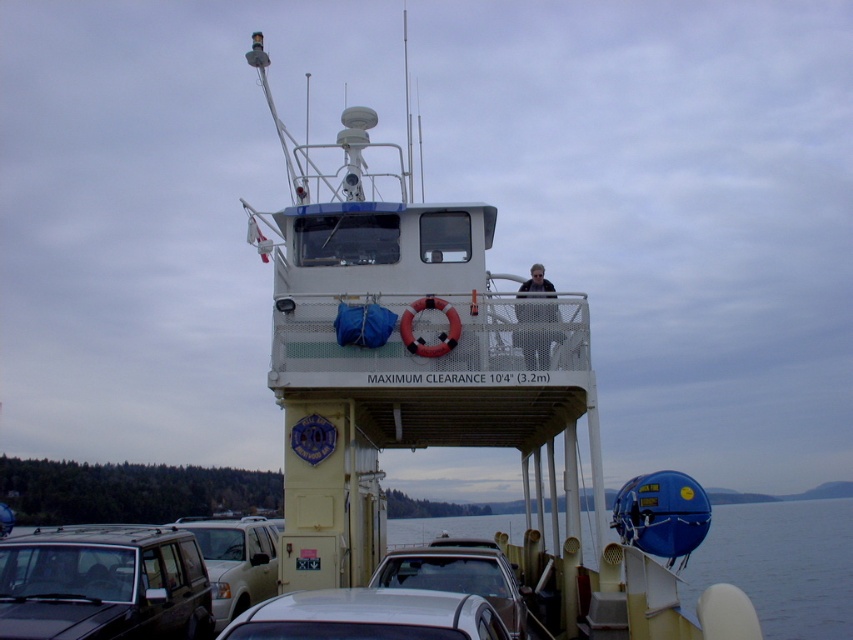
Can you confirm if silver metallic car at lower center is smaller than white glossy sedan at center?

Yes.

From the picture: Is silver metallic car at lower center further to camera compared to white glossy sedan at center?

No, it is in front of white glossy sedan at center.

Who is more forward, [456,614] or [445,564]?

Positioned in front is point [456,614].

In order to click on silver metallic car at lower center in this screenshot , I will do `click(368, 616)`.

Does matte black suv at lower left appear under metallic silver suv at lower left?

No.

Is matte black suv at lower left to the left of metallic silver suv at lower left from the viewer's perspective?

Yes, matte black suv at lower left is to the left of metallic silver suv at lower left.

Is point (137, 532) behind point (273, 561)?

No.

This screenshot has width=853, height=640. Identify the location of matte black suv at lower left. (103, 584).

Does matte black suv at lower left appear on the right side of dark gray mesh jacket at upper center?

Incorrect, matte black suv at lower left is not on the right side of dark gray mesh jacket at upper center.

Can you confirm if matte black suv at lower left is wider than dark gray mesh jacket at upper center?

Yes, matte black suv at lower left is wider than dark gray mesh jacket at upper center.

Image resolution: width=853 pixels, height=640 pixels. Identify the location of matte black suv at lower left. (103, 584).

Locate an element on the screen. matte black suv at lower left is located at coordinates (103, 584).